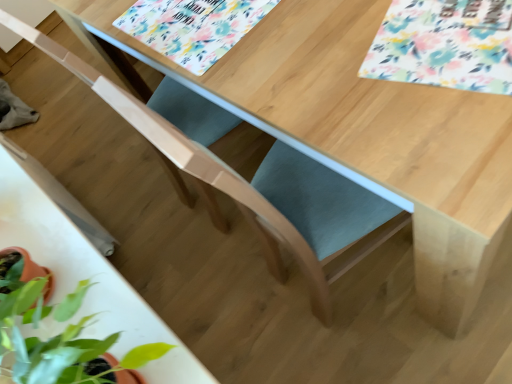
The height and width of the screenshot is (384, 512). What are the coordinates of `free space to the left of floral-patterned paper at upper right, positioned as the first flower in front-to-back order` in the screenshot? It's located at (334, 84).